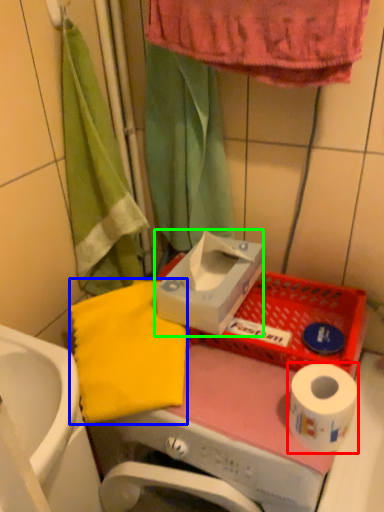
Question: Which object is positioned farthest from toilet paper (highlighted by a red box)? Select from beach towel (highlighted by a blue box) and carton (highlighted by a green box).

Choices:
 (A) beach towel
 (B) carton

Answer: (A)